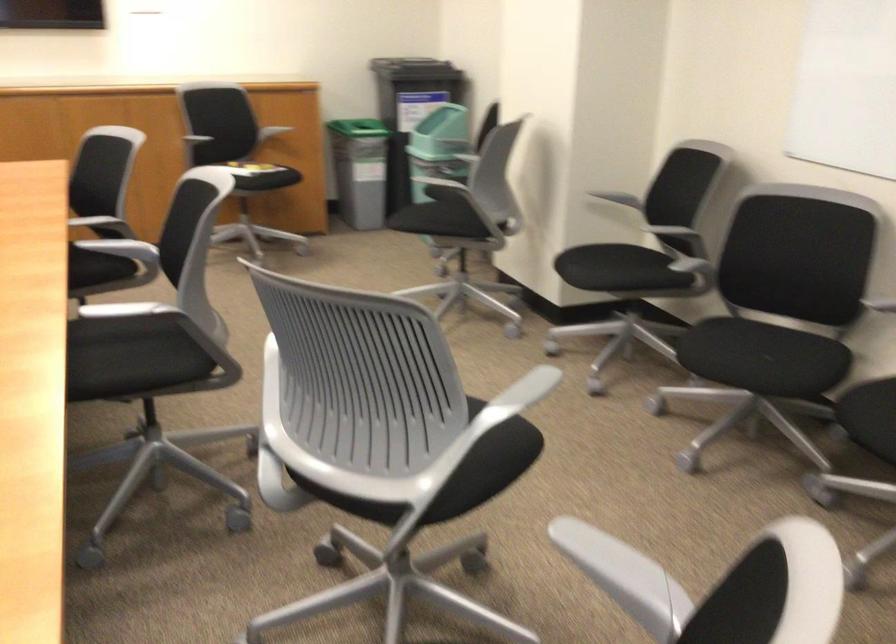
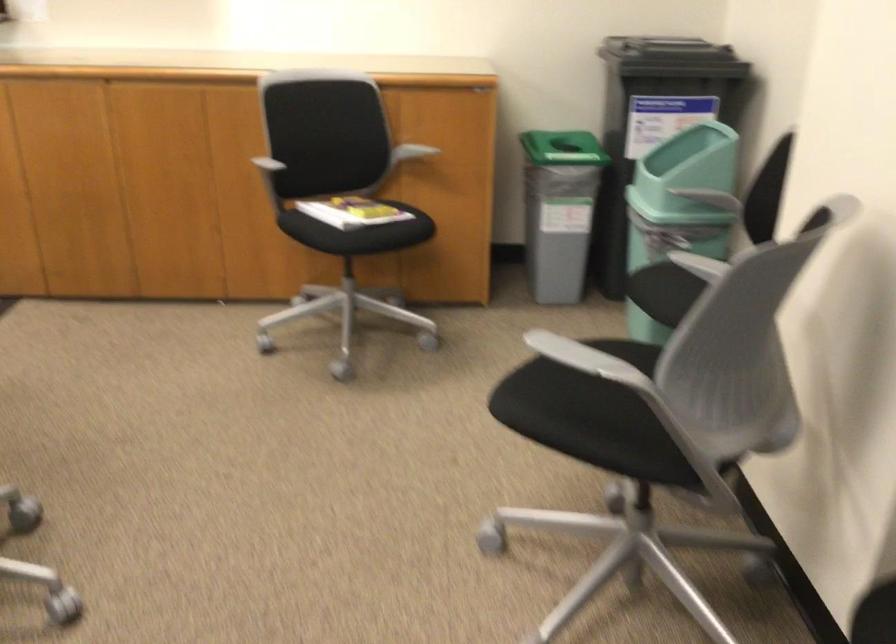
In the second image, find the point that corresponds to point (435, 207) in the first image.

(599, 406)